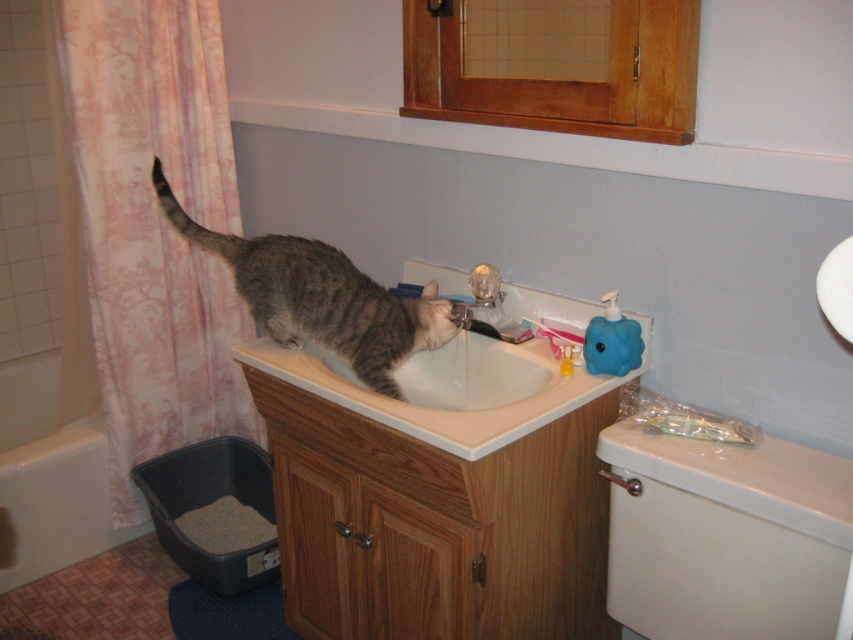
What object is located at the coordinates point (451,387) in the bathroom scene?

The white glossy sink at center is located at point (451,387).

You are a pet owner who wants to place a small plant pot between the white plastic toilet at lower right and the matte silver faucet at sink center. Based on their heights, which object should the plant pot be placed closer to?

The white plastic toilet at lower right is taller than the matte silver faucet at sink center, so the plant pot should be placed closer to the matte silver faucet at sink center to ensure stability and balance.

You are a pet owner who wants to ensure your cat can easily access both the water and the litter box. Given the sizes of the white plastic toilet at lower right and the matte silver faucet at sink center, which object might pose a challenge for the cat to interact with and why?

The white plastic toilet at lower right is larger in size than the matte silver faucet at sink center. The larger size of the toilet could make it harder for the cat to reach the litter box inside, while the smaller faucet is easier for the cat to approach the water source.